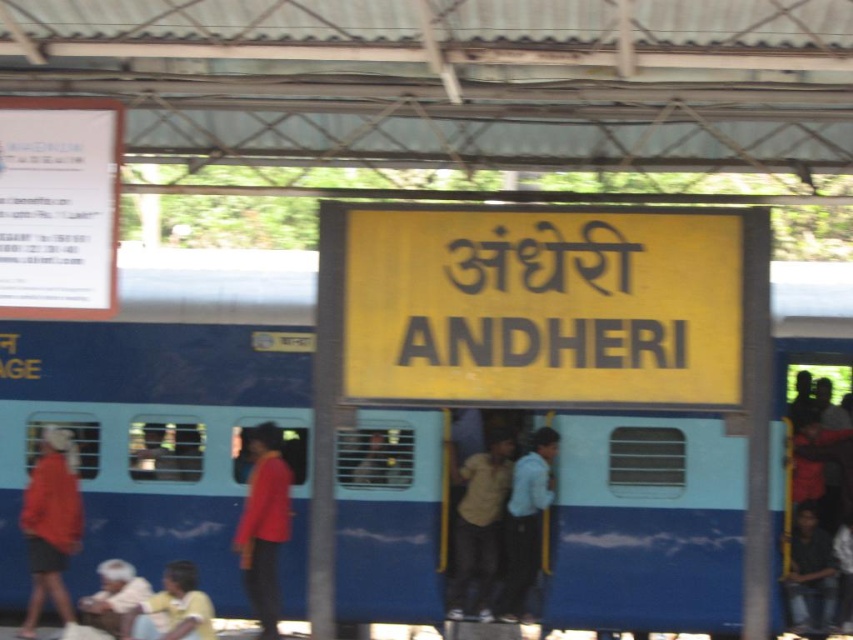
You are standing at the train station in Andheri and want to take a photo of the two points mentioned. Which point, point (260, 449) or point (491, 541), will appear larger in your photo?

Point (260, 449) will appear larger in the photo because it is closer to the camera than point (491, 541).

From the picture: You are a photographer standing at the train station and want to capture a photo of the light blue shirt at center and the white fabric headscarf at lower left. Which of the two items is positioned farther away from you?

The white fabric headscarf at lower left is behind the light blue shirt at center, so it is farther away from you.